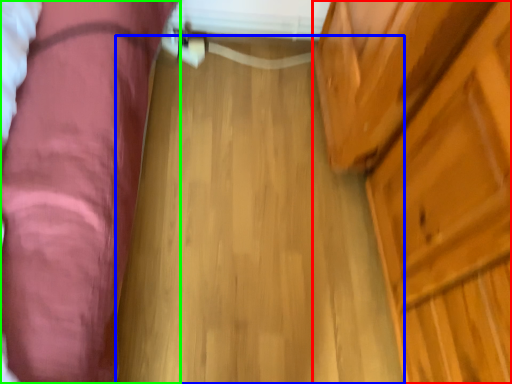
Question: Estimate the real-world distances between objects in this image. Which object is closer to dresser (highlighted by a red box), plank (highlighted by a blue box) or furniture (highlighted by a green box)?

Choices:
 (A) plank
 (B) furniture

Answer: (A)